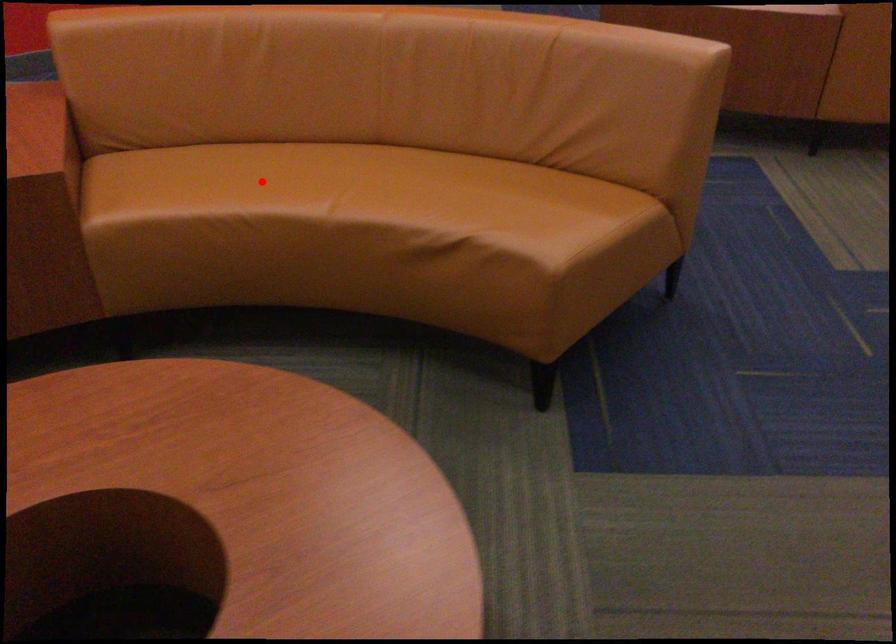
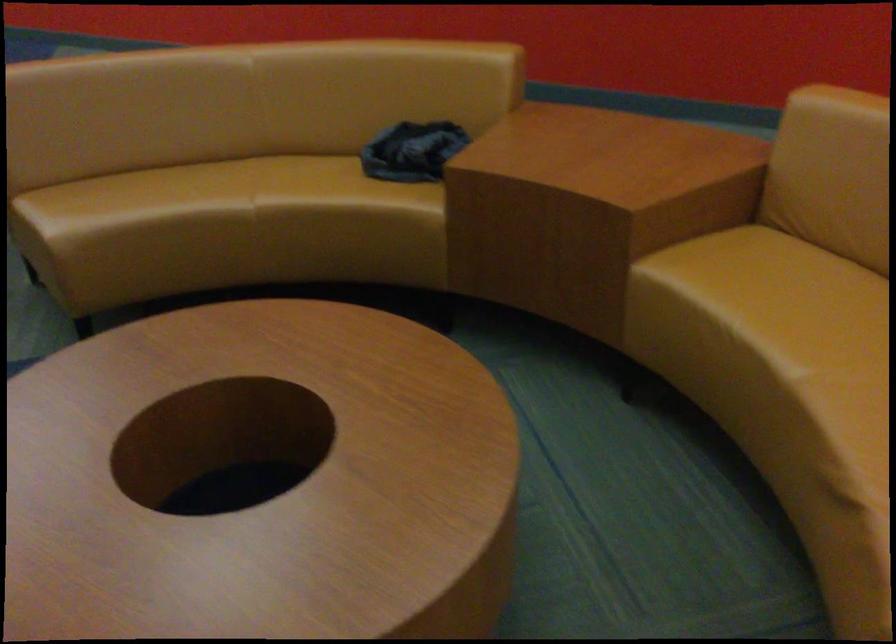
Where in the second image is the point corresponding to the highlighted location from the first image?

(814, 308)